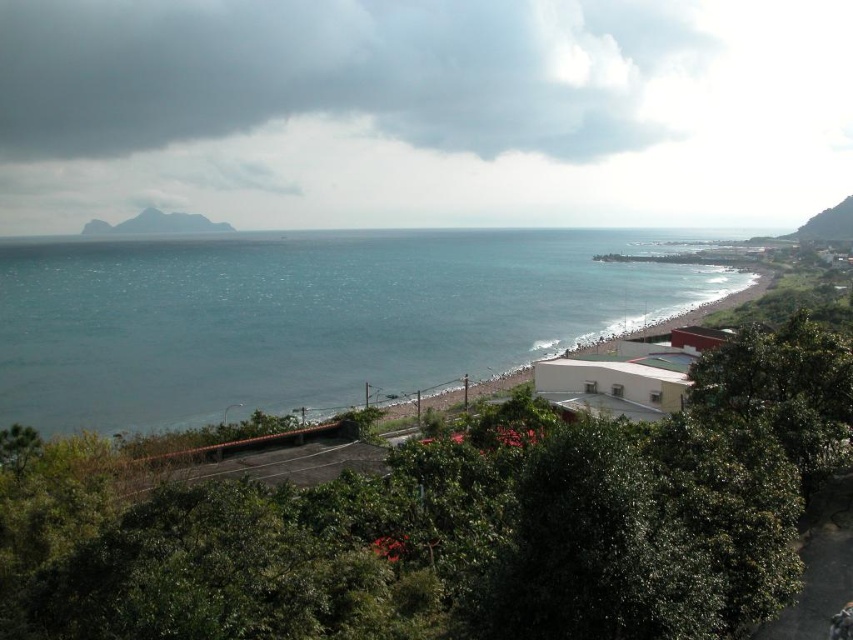
Between blue glossy water at center and green leafy hillside at upper right, which one appears on the left side from the viewer's perspective?

From the viewer's perspective, blue glossy water at center appears more on the left side.

Is point (318, 253) farther from camera compared to point (828, 211)?

No.

Which is behind, point (474, 308) or point (807, 220)?

The point (807, 220) is more distant.

Locate an element on the screen. blue glossy water at center is located at coordinates (306, 316).

Which is more to the right, blue glossy water at center or gray rocky mountain at upper left?

From the viewer's perspective, blue glossy water at center appears more on the right side.

Does blue glossy water at center have a lesser height compared to gray rocky mountain at upper left?

In fact, blue glossy water at center may be taller than gray rocky mountain at upper left.

The image size is (853, 640). What are the coordinates of `blue glossy water at center` in the screenshot? It's located at pyautogui.click(x=306, y=316).

What do you see at coordinates (155, 225) in the screenshot? The height and width of the screenshot is (640, 853). I see `gray rocky mountain at upper left` at bounding box center [155, 225].

Between gray rocky mountain at upper left and green leafy hillside at upper right, which one appears on the right side from the viewer's perspective?

green leafy hillside at upper right

Between point (86, 224) and point (814, 218), which one is positioned behind?

Point (86, 224)

I want to click on gray rocky mountain at upper left, so click(155, 225).